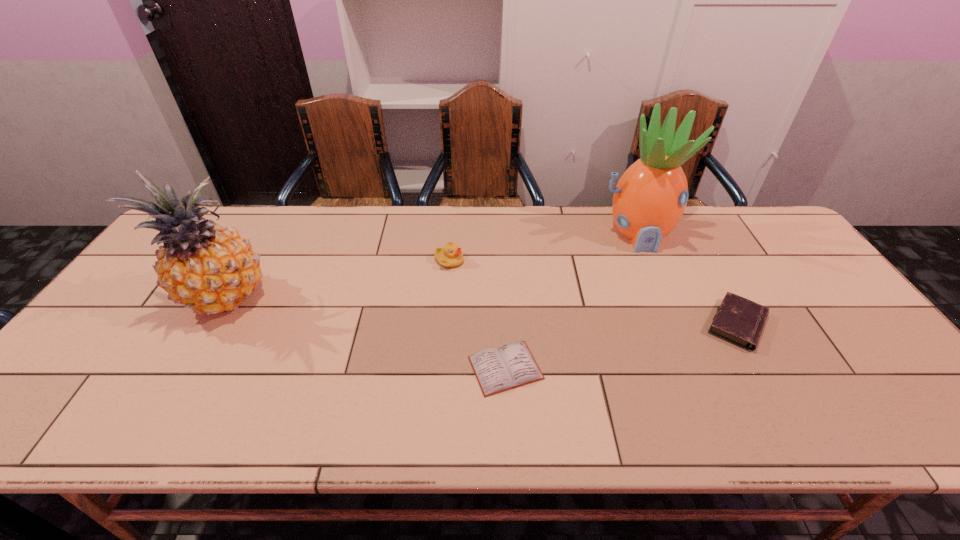
This screenshot has height=540, width=960. What are the coordinates of `free point between the leftmost object and the shortest object` in the screenshot? It's located at (365, 334).

What are the coordinates of `object that is the nearest to the leftmost object` in the screenshot? It's located at (450, 256).

Identify the location of the third closest object to the shorter diary. The width and height of the screenshot is (960, 540). (740, 321).

Where is `vacant space that satisfies the following two spatial constraints: 1. on the front side of the left pineapple; 2. on the left side of the right diary`? The image size is (960, 540). vacant space that satisfies the following two spatial constraints: 1. on the front side of the left pineapple; 2. on the left side of the right diary is located at coordinates (211, 325).

Locate an element on the screen. The image size is (960, 540). free location that satisfies the following two spatial constraints: 1. on the back side of the shorter diary; 2. on the left side of the second shortest object is located at coordinates (503, 325).

I want to click on blank space that satisfies the following two spatial constraints: 1. at the entrance of the farther pineapple; 2. on the right side of the second shortest object, so pyautogui.click(x=675, y=325).

I want to click on vacant region that satisfies the following two spatial constraints: 1. on the front-facing side of the duckling; 2. on the back side of the right diary, so click(x=444, y=325).

This screenshot has height=540, width=960. What are the coordinates of `vacant space that satisfies the following two spatial constraints: 1. on the front-facing side of the left diary; 2. on the right side of the third tallest object` in the screenshot? It's located at (441, 368).

Identify the location of vacant space that satisfies the following two spatial constraints: 1. on the front-facing side of the third object from left to right; 2. on the left side of the third tallest object. (441, 368).

At what (x,y) coordinates should I click in order to perform the action: click on free space that satisfies the following two spatial constraints: 1. on the back side of the shortest object; 2. on the left side of the right diary. Please return your answer as a coordinate pair (x, y). This screenshot has width=960, height=540. Looking at the image, I should click on (503, 325).